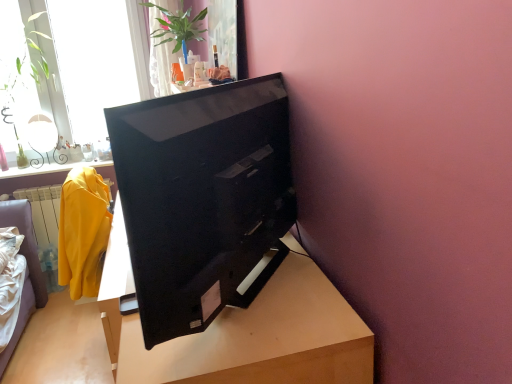
Question: Considering the relative positions of wooden table at center and transparent glass window at upper left in the image provided, is wooden table at center to the right of transparent glass window at upper left from the viewer's perspective?

Choices:
 (A) no
 (B) yes

Answer: (B)

Question: Is wooden table at center bigger than transparent glass window at upper left?

Choices:
 (A) no
 (B) yes

Answer: (B)

Question: Are wooden table at center and transparent glass window at upper left beside each other?

Choices:
 (A) no
 (B) yes

Answer: (A)

Question: Is wooden table at center thinner than transparent glass window at upper left?

Choices:
 (A) no
 (B) yes

Answer: (A)

Question: From a real-world perspective, is wooden table at center located higher than transparent glass window at upper left?

Choices:
 (A) no
 (B) yes

Answer: (A)

Question: Relative to wooden table at center, is black glossy television at center in front or behind?

Choices:
 (A) behind
 (B) front

Answer: (B)

Question: In the image, is black glossy television at center on the left side or the right side of wooden table at center?

Choices:
 (A) right
 (B) left

Answer: (A)

Question: Looking at the image, does black glossy television at center seem bigger or smaller compared to wooden table at center?

Choices:
 (A) big
 (B) small

Answer: (B)

Question: Considering the positions of point (269, 187) and point (253, 380), is point (269, 187) closer or farther from the camera than point (253, 380)?

Choices:
 (A) farther
 (B) closer

Answer: (A)

Question: In the image, is transparent glass window at upper left positioned in front of or behind black glossy television at center?

Choices:
 (A) front
 (B) behind

Answer: (B)

Question: Is transparent glass window at upper left wider or thinner than black glossy television at center?

Choices:
 (A) thin
 (B) wide

Answer: (A)

Question: Visually, is transparent glass window at upper left positioned to the left or to the right of black glossy television at center?

Choices:
 (A) left
 (B) right

Answer: (A)

Question: Looking at the image, does transparent glass window at upper left seem bigger or smaller compared to black glossy television at center?

Choices:
 (A) small
 (B) big

Answer: (B)

Question: Is black glossy television at center taller or shorter than green glossy plant at upper center?

Choices:
 (A) short
 (B) tall

Answer: (A)

Question: From a real-world perspective, is black glossy television at center above or below green glossy plant at upper center?

Choices:
 (A) below
 (B) above

Answer: (A)